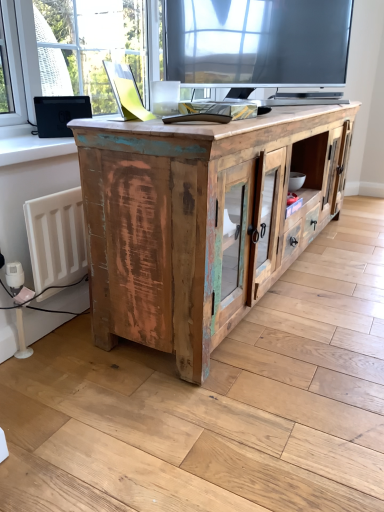
Question: Could you tell me if rustic wood cabinet at center is turned towards white painted wood at left?

Choices:
 (A) yes
 (B) no

Answer: (B)

Question: From the image's perspective, is rustic wood cabinet at center beneath white painted wood at left?

Choices:
 (A) yes
 (B) no

Answer: (A)

Question: Is rustic wood cabinet at center with white painted wood at left?

Choices:
 (A) yes
 (B) no

Answer: (B)

Question: Can you confirm if rustic wood cabinet at center is thinner than white painted wood at left?

Choices:
 (A) no
 (B) yes

Answer: (A)

Question: From a real-world perspective, is rustic wood cabinet at center below white painted wood at left?

Choices:
 (A) yes
 (B) no

Answer: (A)

Question: Considering the relative sizes of rustic wood cabinet at center and white painted wood at left in the image provided, is rustic wood cabinet at center taller than white painted wood at left?

Choices:
 (A) yes
 (B) no

Answer: (A)

Question: Is white painted wood at left next to rustic wood cabinet at center?

Choices:
 (A) yes
 (B) no

Answer: (B)

Question: From the image's perspective, is white painted wood at left on rustic wood cabinet at center?

Choices:
 (A) yes
 (B) no

Answer: (A)

Question: Can rustic wood cabinet at center be found inside white painted wood at left?

Choices:
 (A) yes
 (B) no

Answer: (B)

Question: Considering the relative positions of white painted wood at left and rustic wood cabinet at center in the image provided, is white painted wood at left in front of rustic wood cabinet at center?

Choices:
 (A) no
 (B) yes

Answer: (A)

Question: Is white painted wood at left facing away from rustic wood cabinet at center?

Choices:
 (A) no
 (B) yes

Answer: (A)

Question: Does white painted wood at left have a lesser width compared to rustic wood cabinet at center?

Choices:
 (A) no
 (B) yes

Answer: (B)

Question: From the image's perspective, relative to rustic wood cabinet at center, is white painted wood at left above or below?

Choices:
 (A) above
 (B) below

Answer: (A)